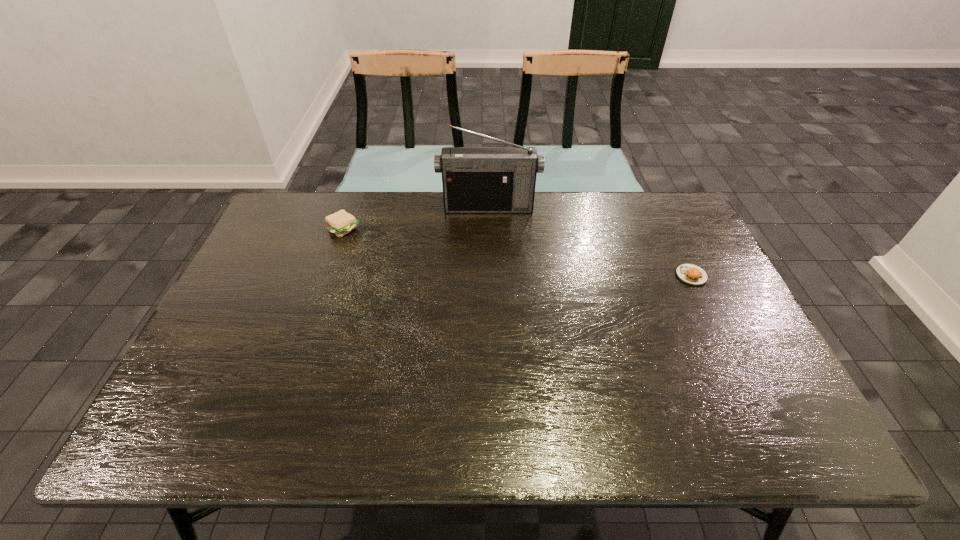
In order to click on free spot that satisfies the following two spatial constraints: 1. on the front-facing side of the rightmost object; 2. on the right side of the second object from right to left in this screenshot , I will do `click(490, 275)`.

The height and width of the screenshot is (540, 960). In order to click on free space that satisfies the following two spatial constraints: 1. on the front-facing side of the farthest object; 2. on the right side of the shorter patty in this screenshot , I will do `click(490, 275)`.

You are a GUI agent. You are given a task and a screenshot of the screen. Output one action in this format:
    pyautogui.click(x=<x>, y=<y>)
    Task: Click on the vacant space that satisfies the following two spatial constraints: 1. on the front-facing side of the tallest object; 2. on the left side of the right patty
    Image resolution: width=960 pixels, height=540 pixels.
    Given the screenshot: What is the action you would take?
    pyautogui.click(x=490, y=275)

Where is `vacant space that satisfies the following two spatial constraints: 1. on the front-facing side of the shortest object; 2. on the right side of the radio receiver`? This screenshot has height=540, width=960. vacant space that satisfies the following two spatial constraints: 1. on the front-facing side of the shortest object; 2. on the right side of the radio receiver is located at coordinates (490, 275).

At what (x,y) coordinates should I click in order to perform the action: click on vacant space that satisfies the following two spatial constraints: 1. on the front side of the shortest object; 2. on the right side of the second nearest object. Please return your answer as a coordinate pair (x, y). Image resolution: width=960 pixels, height=540 pixels. Looking at the image, I should click on (328, 275).

I want to click on vacant space that satisfies the following two spatial constraints: 1. on the front side of the second nearest object; 2. on the right side of the rightmost object, so click(328, 275).